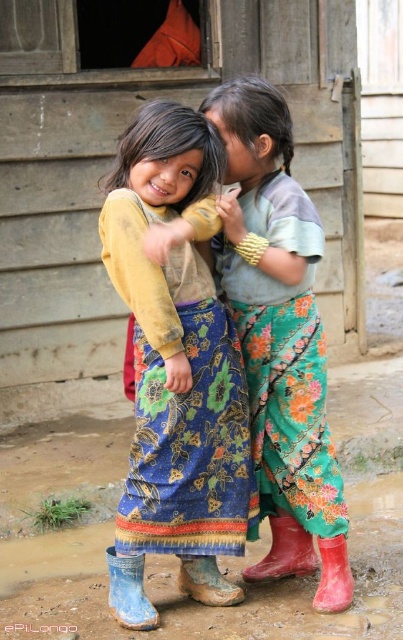
You are a photographer trying to capture both the blue floral skirt at center and the red rubber boot at lower center in a single frame. Given their widths, which object will require you to zoom out more to include its entire width in the photo?

The blue floral skirt at center has a greater width than the red rubber boot at lower center, so you will need to zoom out more to capture the entire width of the blue floral skirt at center.

You are a photographer trying to capture a photo of the blue floral skirt at center and the red rubber boot at lower center. Since you want to ensure both are in focus, you need to know which object is taller. Can you tell me which one is taller?

The blue floral skirt at center is taller than the red rubber boot at lower center according to the description.

You are a photographer trying to capture a clear shot of the floral fabric skirt at center and the blue rubber boot at lower left. Since you want both in focus, which object should you adjust your camera to prioritize focusing on first?

The floral fabric skirt at center is closer to the viewer than the blue rubber boot at lower left, so you should focus on the floral fabric skirt at center first to ensure both are in focus.